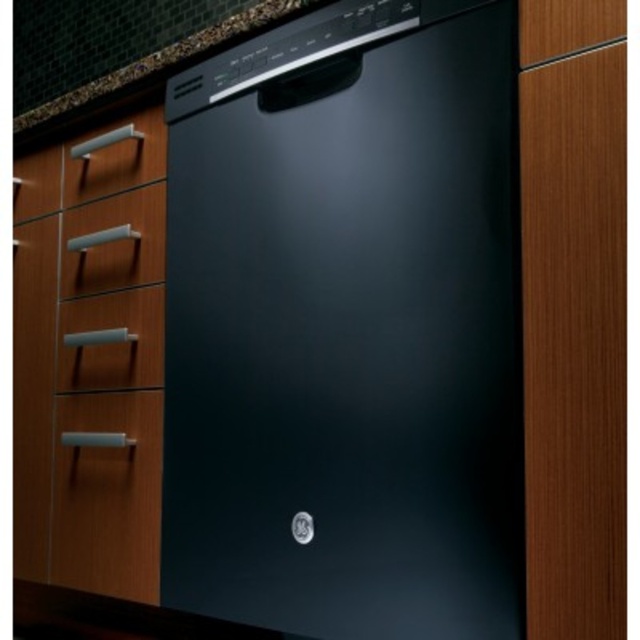
Does satin nickel drawer at center have a smaller size compared to satin nickel drawer at upper left?

Incorrect, satin nickel drawer at center is not smaller in size than satin nickel drawer at upper left.

Between satin nickel drawer at center and satin nickel drawer at upper left, which one is positioned lower?

satin nickel drawer at center is lower down.

Describe the element at coordinates (113, 243) in the screenshot. I see `satin nickel drawer at center` at that location.

Identify the location of satin nickel drawer at center. Image resolution: width=640 pixels, height=640 pixels. (113, 243).

Is black matte dishwasher at center bigger than satin nickel drawer at center?

Correct, black matte dishwasher at center is larger in size than satin nickel drawer at center.

Between black matte dishwasher at center and satin nickel drawer at center, which one is positioned higher?

Positioned higher is satin nickel drawer at center.

Is point (444, 163) positioned in front of point (145, 252)?

Yes, point (444, 163) is in front of point (145, 252).

The image size is (640, 640). What are the coordinates of `black matte dishwasher at center` in the screenshot? It's located at (348, 326).

Who is shorter, black matte dishwasher at center or matte silver drawer at lower left?

matte silver drawer at lower left

Based on the photo, does black matte dishwasher at center appear under matte silver drawer at lower left?

Incorrect, black matte dishwasher at center is not positioned below matte silver drawer at lower left.

Does point (410, 317) come farther from viewer compared to point (136, 355)?

No.

Image resolution: width=640 pixels, height=640 pixels. In order to click on black matte dishwasher at center in this screenshot , I will do `click(348, 326)`.